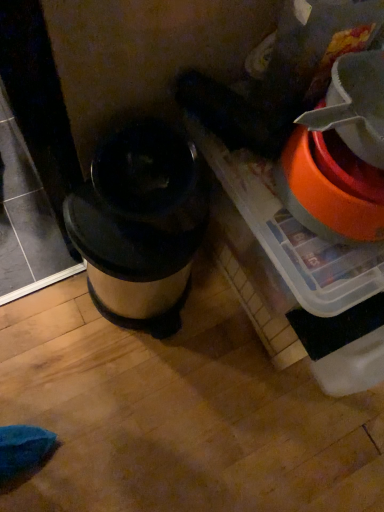
Where is `unoccupied region to the right of metallic silver trash can at center`? Image resolution: width=384 pixels, height=512 pixels. unoccupied region to the right of metallic silver trash can at center is located at coordinates (222, 335).